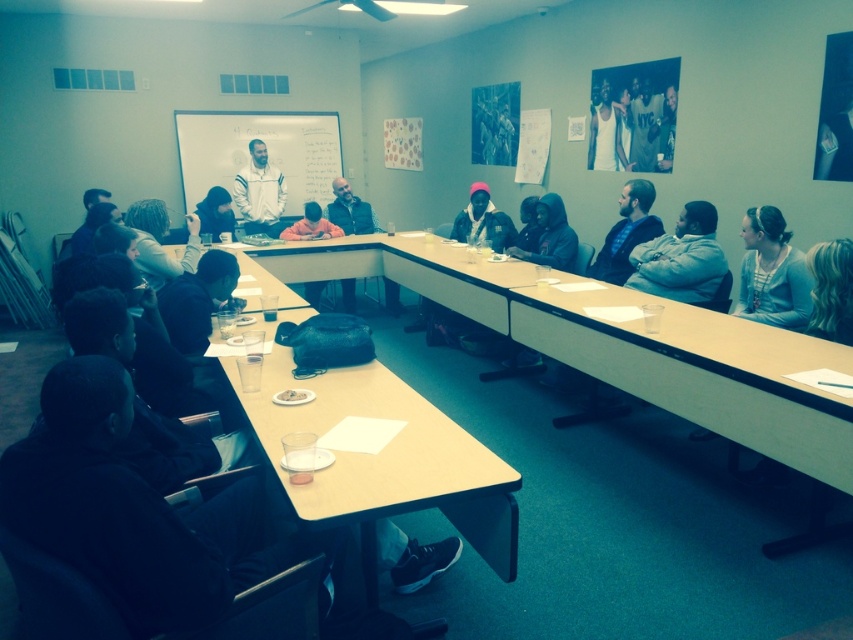
Can you confirm if blue sweater at right is positioned above orange fleece jacket at center?

Incorrect, blue sweater at right is not positioned above orange fleece jacket at center.

Between point (740, 228) and point (312, 208), which one is positioned in front?

Positioned in front is point (740, 228).

The height and width of the screenshot is (640, 853). I want to click on blue sweater at right, so click(770, 273).

Consider the image. Is blue sweater at right below matte black jacket at upper center?

Correct, blue sweater at right is located below matte black jacket at upper center.

Does blue sweater at right have a lesser width compared to matte black jacket at upper center?

Yes.

Who is more distant from viewer, (769, 289) or (206, 228)?

The point (206, 228) is behind.

The height and width of the screenshot is (640, 853). I want to click on blue sweater at right, so click(x=770, y=273).

Is light brown wood table at center taller than orange fleece jacket at center?

Correct, light brown wood table at center is much taller as orange fleece jacket at center.

Image resolution: width=853 pixels, height=640 pixels. Find the location of `light brown wood table at center`. light brown wood table at center is located at coordinates (381, 461).